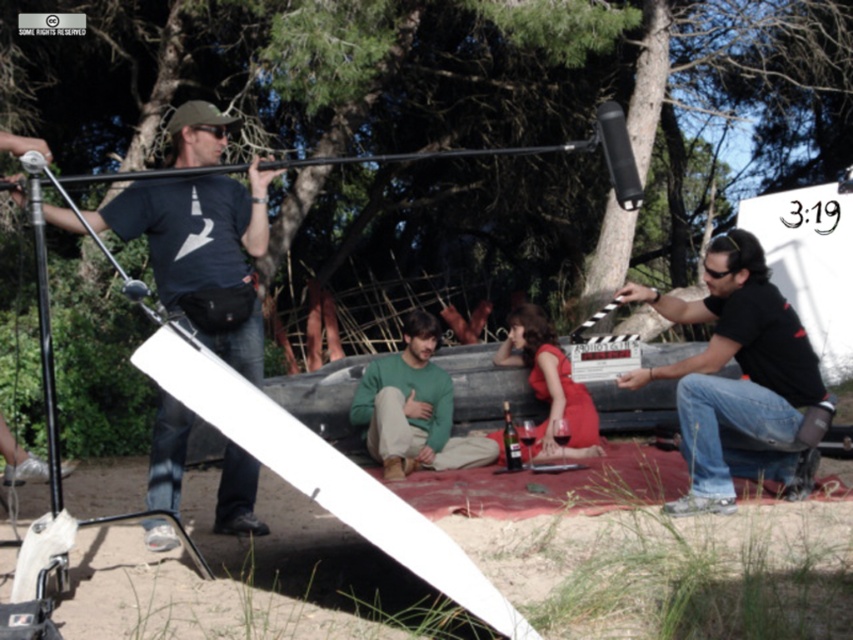
Question: Does matte black t-shirt at left appear over green matte sweater at center?

Choices:
 (A) no
 (B) yes

Answer: (B)

Question: Which object appears farthest from the camera in this image?

Choices:
 (A) green matte sweater at center
 (B) matte red dress at center
 (C) matte black t-shirt at left

Answer: (B)

Question: Does matte black t-shirt at left have a lesser width compared to green matte sweater at center?

Choices:
 (A) no
 (B) yes

Answer: (B)

Question: Which of these objects is positioned farthest from the black matte shirt at right?

Choices:
 (A) green matte sweater at center
 (B) matte black t-shirt at left

Answer: (B)

Question: Among these points, which one is farthest from the camera?

Choices:
 (A) pos(390,380)
 (B) pos(579,392)
 (C) pos(224,346)
 (D) pos(764,400)

Answer: (B)

Question: Does matte black t-shirt at left appear on the right side of green matte sweater at center?

Choices:
 (A) yes
 (B) no

Answer: (B)